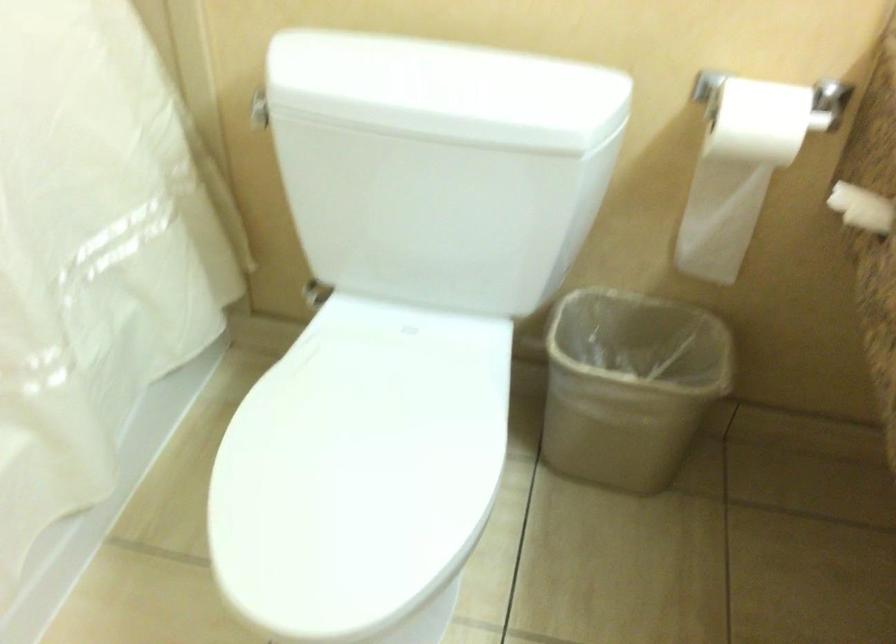
This screenshot has width=896, height=644. Identify the location of white toilet lid. (446, 90).